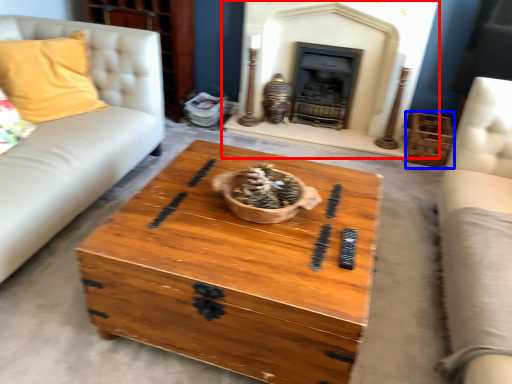
Question: Which object is closer to the camera taking this photo, fireplace (highlighted by a red box) or crate (highlighted by a blue box)?

Choices:
 (A) fireplace
 (B) crate

Answer: (A)